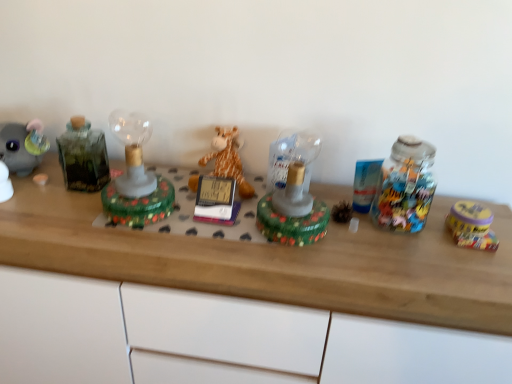
Where is `vacant area that lies to the right of green glass lamp at center, which appears as the fourth toy when viewed from the right`? Image resolution: width=512 pixels, height=384 pixels. vacant area that lies to the right of green glass lamp at center, which appears as the fourth toy when viewed from the right is located at coordinates (200, 231).